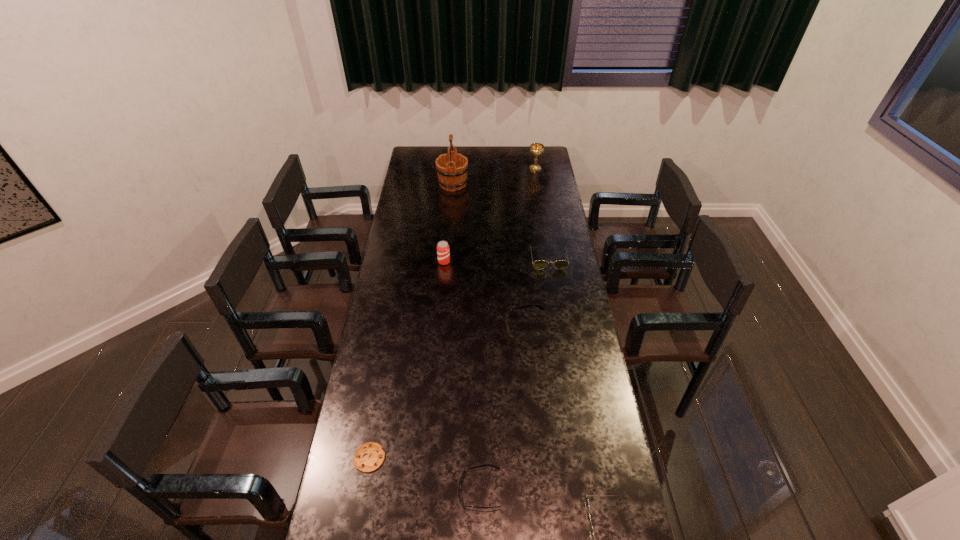
This screenshot has width=960, height=540. Identify the location of free space between the sixth shortest object and the second tallest object. (490, 215).

You are a GUI agent. You are given a task and a screenshot of the screen. Output one action in this format:
    pyautogui.click(x=<x>, y=<y>)
    Task: Click on the free spot between the fourth object from left to right and the wine bucket
    
    Given the screenshot: What is the action you would take?
    pyautogui.click(x=467, y=337)

Locate an element on the screen. object that is the sixth closest one to the chalice is located at coordinates (369, 456).

At what (x,y) coordinates should I click in order to perform the action: click on object that is the sixth closest to the nearer green sunglasses. Please return your answer as a coordinate pair (x, y). This screenshot has width=960, height=540. Looking at the image, I should click on (452, 167).

Identify which sunglasses is the closest to the chalice. Please provide its 2D coordinates. Your answer should be formatted as a tuple, i.e. [(x, y)], where the tuple contains the x and y coordinates of a point satisfying the conditions above.

[(539, 264)]

Identify which sunglasses is the second closest to the nearer green sunglasses. Please provide its 2D coordinates. Your answer should be formatted as a tuple, i.e. [(x, y)], where the tuple contains the x and y coordinates of a point satisfying the conditions above.

[(508, 311)]

Image resolution: width=960 pixels, height=540 pixels. What are the coordinates of `free region that satisfies the following two spatial constraints: 1. on the back side of the beer can; 2. on the right side of the wine bucket` in the screenshot? It's located at (450, 184).